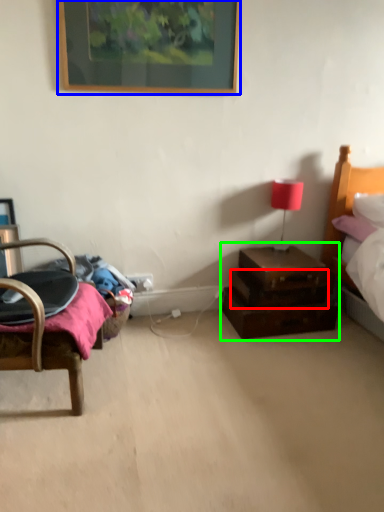
Question: Which object is the closest to the drawer (highlighted by a red box)? Choose among these: picture frame (highlighted by a blue box) or nightstand (highlighted by a green box).

Choices:
 (A) picture frame
 (B) nightstand

Answer: (B)